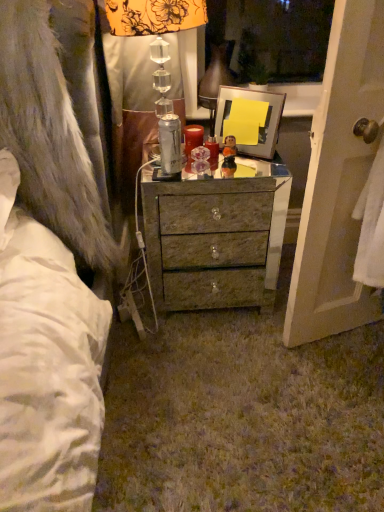
Where is `free space in front of shiny metallic drawer at center`? free space in front of shiny metallic drawer at center is located at coordinates [x=212, y=364].